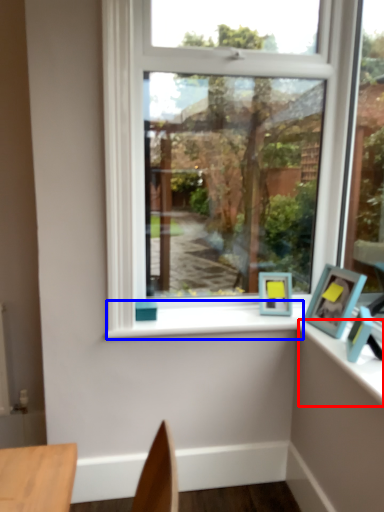
Question: Which point is closer to the camera, counter top (highlighted by a red box) or window sill (highlighted by a blue box)?

Choices:
 (A) counter top
 (B) window sill

Answer: (A)